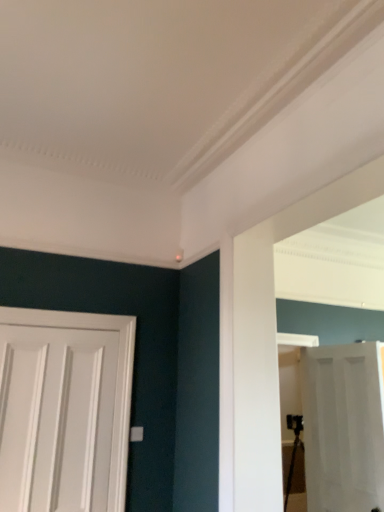
This screenshot has height=512, width=384. Describe the element at coordinates (343, 426) in the screenshot. I see `white matte door at right, which ranks as the 2th door in front-to-back order` at that location.

You are a GUI agent. You are given a task and a screenshot of the screen. Output one action in this format:
    pyautogui.click(x=<x>, y=<y>)
    Task: Click on the white matte door at right, which is counted as the 1th door, starting from the back
    This screenshot has width=384, height=512.
    Given the screenshot: What is the action you would take?
    pyautogui.click(x=343, y=426)

What do you see at coordinates (64, 410) in the screenshot? I see `white matte door at left, the 2th door from the right` at bounding box center [64, 410].

Locate an element on the screen. The height and width of the screenshot is (512, 384). white matte door at left, arranged as the first door when viewed from the left is located at coordinates (64, 410).

I want to click on white matte door at right, which is counted as the 1th door, starting from the back, so click(x=343, y=426).

Considering the positions of objects white matte door at right, placed as the second door when sorted from left to right, and white matte door at left, placed as the 1th door when sorted from front to back, in the image provided, who is more to the right, white matte door at right, placed as the second door when sorted from left to right, or white matte door at left, placed as the 1th door when sorted from front to back,?

From the viewer's perspective, white matte door at right, placed as the second door when sorted from left to right, appears more on the right side.

Relative to white matte door at left, the 2th door from the right, is white matte door at right, which ranks as the 2th door in front-to-back order, in front or behind?

In the image, white matte door at right, which ranks as the 2th door in front-to-back order, appears behind white matte door at left, the 2th door from the right.

Is point (347, 358) more distant than point (55, 446)?

Yes, point (347, 358) is behind point (55, 446).

From the image's perspective, which is above, white matte door at right, the 1th door positioned from the right, or white matte door at left, placed as the 1th door when sorted from front to back?

white matte door at left, placed as the 1th door when sorted from front to back.

From a real-world perspective, who is located higher, white matte door at right, which ranks as the 2th door in front-to-back order, or white matte door at left, arranged as the first door when viewed from the left?

From a 3D spatial view, white matte door at left, arranged as the first door when viewed from the left, is above.

Which of these two, white matte door at right, placed as the second door when sorted from left to right, or white matte door at left, the 2th door from the right, is wider?

Wider between the two is white matte door at right, placed as the second door when sorted from left to right.

Considering the relative sizes of white matte door at right, the 1th door positioned from the right, and white matte door at left, the 2th door from the right, in the image provided, is white matte door at right, the 1th door positioned from the right, shorter than white matte door at left, the 2th door from the right,?

In fact, white matte door at right, the 1th door positioned from the right, may be taller than white matte door at left, the 2th door from the right.

Looking at the image, does white matte door at right, which ranks as the 2th door in front-to-back order, seem bigger or smaller compared to white matte door at left, arranged as the first door when viewed from the left?

Considering their sizes, white matte door at right, which ranks as the 2th door in front-to-back order, takes up more space than white matte door at left, arranged as the first door when viewed from the left.

Is white matte door at right, which is counted as the 1th door, starting from the back, completely or partially outside of white matte door at left, placed as the 1th door when sorted from front to back?

white matte door at right, which is counted as the 1th door, starting from the back, lies outside white matte door at left, placed as the 1th door when sorted from front to back,'s area.

Would you consider white matte door at right, the 1th door positioned from the right, to be distant from white matte door at left, arranged as the first door when viewed from the left?

white matte door at right, the 1th door positioned from the right, is far away from white matte door at left, arranged as the first door when viewed from the left.

Is white matte door at right, which ranks as the 2th door in front-to-back order, facing towards white matte door at left, marked as the 2th door in a back-to-front arrangement?

Yes, white matte door at right, which ranks as the 2th door in front-to-back order, is facing white matte door at left, marked as the 2th door in a back-to-front arrangement.

Find the location of a particular element. This screenshot has height=512, width=384. door located behind the white matte door at left, placed as the 1th door when sorted from front to back is located at coordinates (343, 426).

Between white matte door at left, placed as the 1th door when sorted from front to back, and white matte door at right, which ranks as the 2th door in front-to-back order, which one appears on the right side from the viewer's perspective?

From the viewer's perspective, white matte door at right, which ranks as the 2th door in front-to-back order, appears more on the right side.

Relative to white matte door at right, which ranks as the 2th door in front-to-back order, is white matte door at left, the 2th door from the right, in front or behind?

In the image, white matte door at left, the 2th door from the right, appears in front of white matte door at right, which ranks as the 2th door in front-to-back order.

Looking at this image, which is farther, (71, 436) or (309, 443)?

The point (309, 443) is farther.

From the image's perspective, is white matte door at left, marked as the 2th door in a back-to-front arrangement, located above white matte door at right, which is counted as the 1th door, starting from the back?

Correct, white matte door at left, marked as the 2th door in a back-to-front arrangement, appears higher than white matte door at right, which is counted as the 1th door, starting from the back, in the image.

From a real-world perspective, who is located higher, white matte door at left, arranged as the first door when viewed from the left, or white matte door at right, the 1th door positioned from the right?

In real-world perspective, white matte door at left, arranged as the first door when viewed from the left, is above.

Between white matte door at left, placed as the 1th door when sorted from front to back, and white matte door at right, placed as the second door when sorted from left to right, which one has smaller width?

white matte door at left, placed as the 1th door when sorted from front to back, is thinner.

Considering the relative sizes of white matte door at left, marked as the 2th door in a back-to-front arrangement, and white matte door at right, which is counted as the 1th door, starting from the back, in the image provided, is white matte door at left, marked as the 2th door in a back-to-front arrangement, taller than white matte door at right, which is counted as the 1th door, starting from the back,?

In fact, white matte door at left, marked as the 2th door in a back-to-front arrangement, may be shorter than white matte door at right, which is counted as the 1th door, starting from the back.

Based on their sizes in the image, would you say white matte door at left, placed as the 1th door when sorted from front to back, is bigger or smaller than white matte door at right, which is counted as the 1th door, starting from the back?

white matte door at left, placed as the 1th door when sorted from front to back, is smaller than white matte door at right, which is counted as the 1th door, starting from the back.

Is white matte door at left, the 2th door from the right, located outside white matte door at right, placed as the second door when sorted from left to right?

Yes, white matte door at left, the 2th door from the right, is located beyond the bounds of white matte door at right, placed as the second door when sorted from left to right.

Is white matte door at left, placed as the 1th door when sorted from front to back, placed right next to white matte door at right, which ranks as the 2th door in front-to-back order?

white matte door at left, placed as the 1th door when sorted from front to back, and white matte door at right, which ranks as the 2th door in front-to-back order, are clearly separated.

Is white matte door at left, arranged as the first door when viewed from the left, facing towards white matte door at right, which is counted as the 1th door, starting from the back?

No, white matte door at left, arranged as the first door when viewed from the left, is not facing towards white matte door at right, which is counted as the 1th door, starting from the back.

How different are the orientations of white matte door at left, placed as the 1th door when sorted from front to back, and white matte door at right, placed as the second door when sorted from left to right, in degrees?

They differ by 89.2 degrees in their facing directions.

Identify the location of door below the white matte door at left, arranged as the first door when viewed from the left (from a real-world perspective). The width and height of the screenshot is (384, 512). (343, 426).

There is a white matte door at right, which is counted as the 1th door, starting from the back. At what (x,y) coordinates should I click in order to perform the action: click on door above it (from a real-world perspective). Please return your answer as a coordinate pair (x, y). Image resolution: width=384 pixels, height=512 pixels. Looking at the image, I should click on (64, 410).

Locate an element on the screen. door below the white matte door at left, placed as the 1th door when sorted from front to back (from a real-world perspective) is located at coordinates (343, 426).